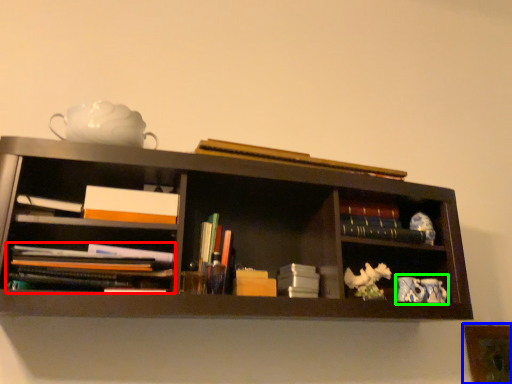
Question: Which object is positioned farthest from book (highlighted by a red box)? Select from picture frame (highlighted by a blue box) and tea set (highlighted by a green box).

Choices:
 (A) picture frame
 (B) tea set

Answer: (A)